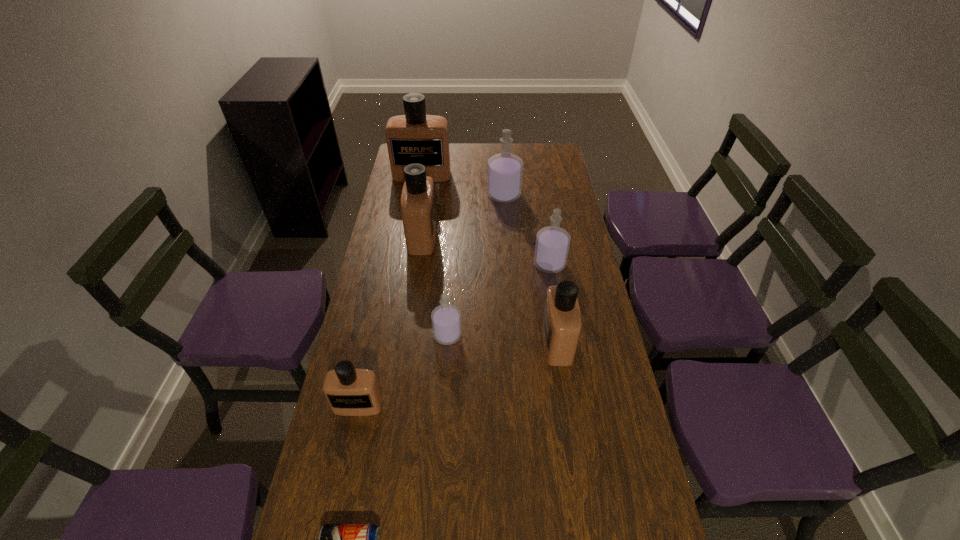
The height and width of the screenshot is (540, 960). I want to click on vacant region between the second farthest beige perfume and the third object from right to left, so click(x=464, y=216).

Point out which object is positioned as the fifth nearest to the second nearest purple perfume. Please provide its 2D coordinates. Your answer should be formatted as a tuple, i.e. [(x, y)], where the tuple contains the x and y coordinates of a point satisfying the conditions above.

[(415, 137)]

Identify the location of object identified as the fourth closest to the seventh farthest object. Image resolution: width=960 pixels, height=540 pixels. (418, 209).

Locate an element on the screen. the fourth closest perfume to the farthest perfume is located at coordinates (446, 319).

Locate which perfume ranks fourth in proximity to the third smallest beige perfume. Please provide its 2D coordinates. Your answer should be formatted as a tuple, i.e. [(x, y)], where the tuple contains the x and y coordinates of a point satisfying the conditions above.

[(552, 245)]

Where is `the closest beige perfume to the nearest purple perfume`? Image resolution: width=960 pixels, height=540 pixels. the closest beige perfume to the nearest purple perfume is located at coordinates pos(350,392).

What are the coordinates of `the closest beige perfume to the second biggest purple perfume` in the screenshot? It's located at (561, 326).

At what (x,y) coordinates should I click in order to perform the action: click on the second closest purple perfume to the rightmost beige perfume. Please return your answer as a coordinate pair (x, y). This screenshot has height=540, width=960. Looking at the image, I should click on (446, 319).

Where is `purple perfume object that ranks as the closest to the smallest beige perfume`? This screenshot has height=540, width=960. purple perfume object that ranks as the closest to the smallest beige perfume is located at coordinates (446, 319).

The height and width of the screenshot is (540, 960). In order to click on vacant space that satisfies the following two spatial constraints: 1. on the front label of the nearest purple perfume; 2. on the right side of the farthest perfume in this screenshot , I will do `click(395, 335)`.